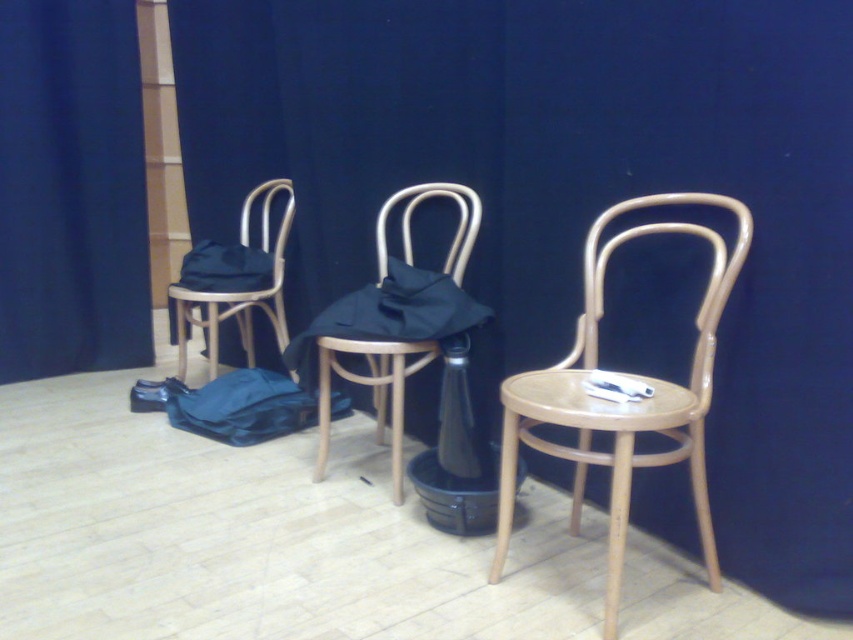
You are standing in front of the three wooden chairs. There is a point marked at coordinates (230,404). Which object is this point located on?

The point at (230,404) is located on the blue fabric bag at center.

You are standing in front of the three wooden chairs and want to know the location of the blue fabric curtain at left. Where is it located relative to the chairs?

The blue fabric curtain at left is located at point (71, 189) relative to the chairs.

You are a stagehand who needs to move a 1 meter long ladder from the blue fabric curtain at left to the blue fabric bag at center. Can you move the ladder horizontally without tilting it?

The blue fabric curtain at left and blue fabric bag at center are 1.01 meters apart from each other, so yes, the ladder can be moved horizontally between them since the distance is slightly more than the ladder length.